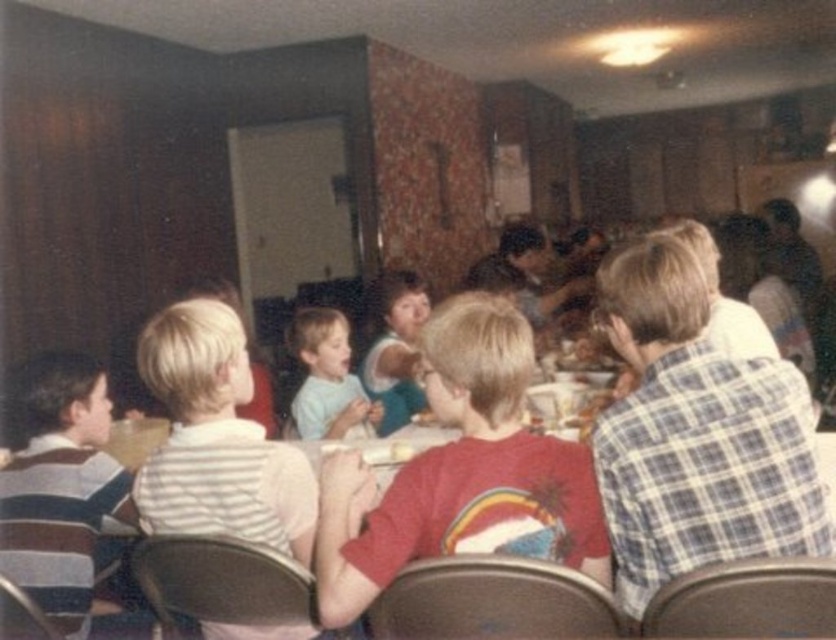
Question: Where is red plaid shirt at center located in relation to light blue shirt at center in the image?

Choices:
 (A) left
 (B) right

Answer: (B)

Question: Which object is closer to the camera taking this photo?

Choices:
 (A) red plaid shirt at center
 (B) light blue shirt at center

Answer: (A)

Question: Does red plaid shirt at center appear under light blue shirt at center?

Choices:
 (A) yes
 (B) no

Answer: (A)

Question: Does red plaid shirt at center appear on the left side of light blue shirt at center?

Choices:
 (A) yes
 (B) no

Answer: (B)

Question: Which point is closer to the camera?

Choices:
 (A) red plaid shirt at center
 (B) light blue shirt at center

Answer: (A)